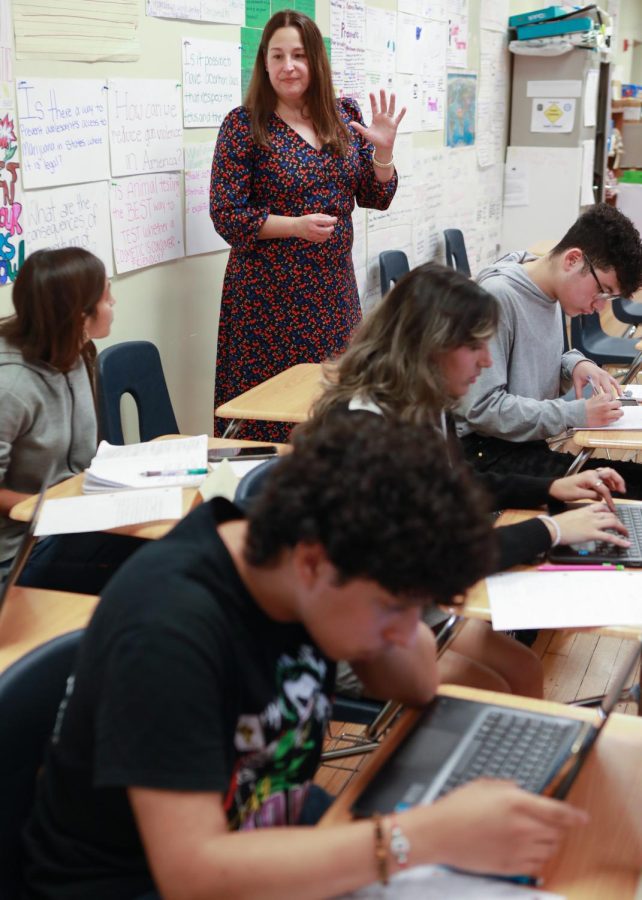
Image resolution: width=642 pixels, height=900 pixels. I want to click on wall, so [171, 302].